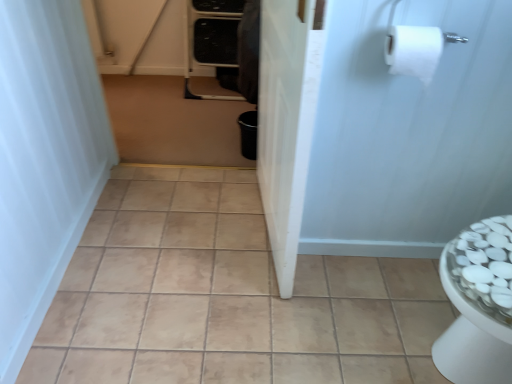
Locate an element on the screen. The height and width of the screenshot is (384, 512). vacant space situated on the left part of white glossy screen door at center, which is counted as the second screen door, starting from the right is located at coordinates (176, 227).